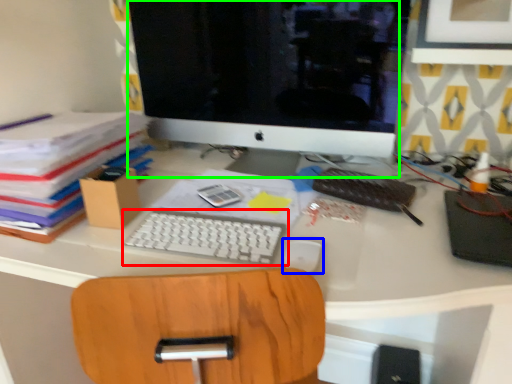
Question: Considering the real-world distances, which object is farthest from computer keyboard (highlighted by a red box)? mouse (highlighted by a blue box) or computer monitor (highlighted by a green box)?

Choices:
 (A) mouse
 (B) computer monitor

Answer: (B)